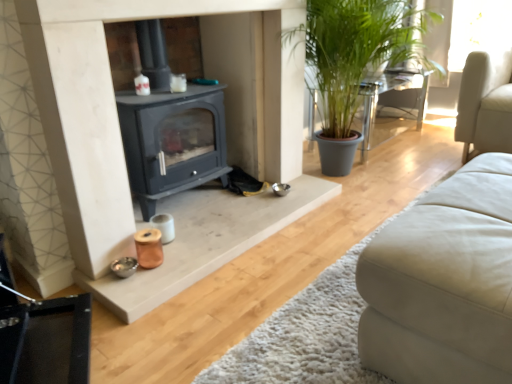
Question: Does point (372, 91) appear closer or farther from the camera than point (375, 256)?

Choices:
 (A) farther
 (B) closer

Answer: (A)

Question: Is green leafy plant at right situated inside white leather studio couch at lower right or outside?

Choices:
 (A) outside
 (B) inside

Answer: (A)

Question: Considering their positions, is green leafy plant at right located in front of or behind white leather studio couch at lower right?

Choices:
 (A) front
 (B) behind

Answer: (B)

Question: Looking at their shapes, would you say white leather studio couch at lower right is wider or thinner than green leafy plant at right?

Choices:
 (A) thin
 (B) wide

Answer: (B)

Question: Considering the positions of white leather studio couch at lower right and green leafy plant at right in the image, is white leather studio couch at lower right taller or shorter than green leafy plant at right?

Choices:
 (A) tall
 (B) short

Answer: (B)

Question: Is white leather studio couch at lower right bigger or smaller than green leafy plant at right?

Choices:
 (A) small
 (B) big

Answer: (A)

Question: From the image's perspective, is white leather studio couch at lower right located above or below green leafy plant at right?

Choices:
 (A) above
 (B) below

Answer: (B)